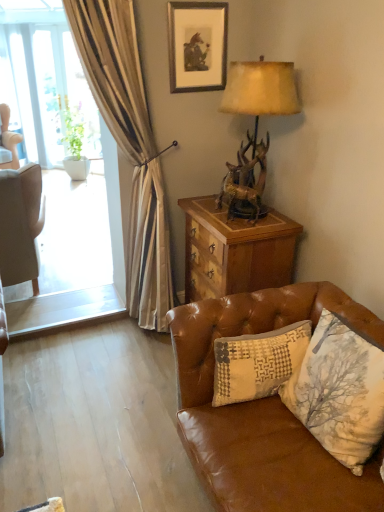
Question: Is wooden chest at right inside or outside of matte black picture frame at upper center?

Choices:
 (A) outside
 (B) inside

Answer: (A)

Question: From a real-world perspective, relative to matte black picture frame at upper center, is wooden chest at right vertically above or below?

Choices:
 (A) above
 (B) below

Answer: (B)

Question: Based on their relative distances, which object is nearer to the antler-patterned wood lamp at upper right?

Choices:
 (A) wooden chest at right
 (B) matte black picture frame at upper center
 (C) patchwork fabric pillow at lower right
 (D) brown leather couch at lower right
 (E) green leafy plant at left

Answer: (B)

Question: Which object is positioned farthest from the brown leather couch at lower right?

Choices:
 (A) patchwork fabric pillow at lower right
 (B) matte black picture frame at upper center
 (C) green leafy plant at left
 (D) antler-patterned wood lamp at upper right
 (E) white fabric chair at left, the second chair when ordered from bottom to top

Answer: (C)